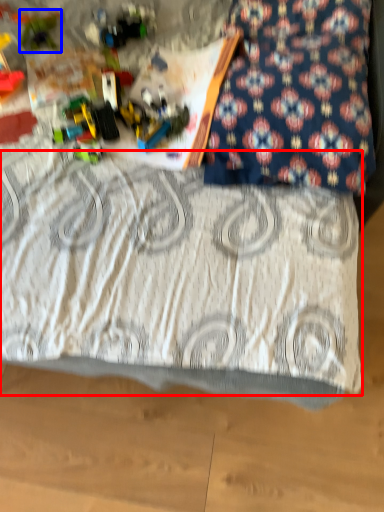
Question: Which object is closer to the camera taking this photo, bedding (highlighted by a red box) or toy (highlighted by a blue box)?

Choices:
 (A) bedding
 (B) toy

Answer: (A)